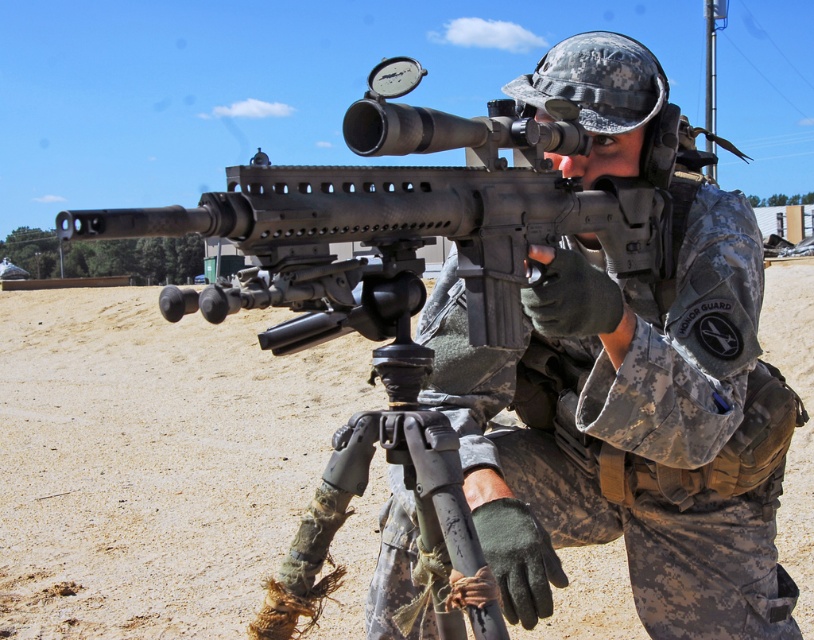
You are a drone operator controlling a drone with a 3.5 meter wingspan. You need to fly your drone over the dirt field at center and the camouflage uniform at center. Can the drone safely pass between them without hitting either object?

The dirt field at center is 2.87 meters away from the camouflage uniform at center. Since the drone has a wingspan of 3.5 meters, which is wider than the 2.87 meter gap between the two objects, the drone cannot safely pass between them without risking collision.

What is located at the point with coordinates (154,460) in the image?

The point at coordinates (154,460) indicates a dirt field at center.